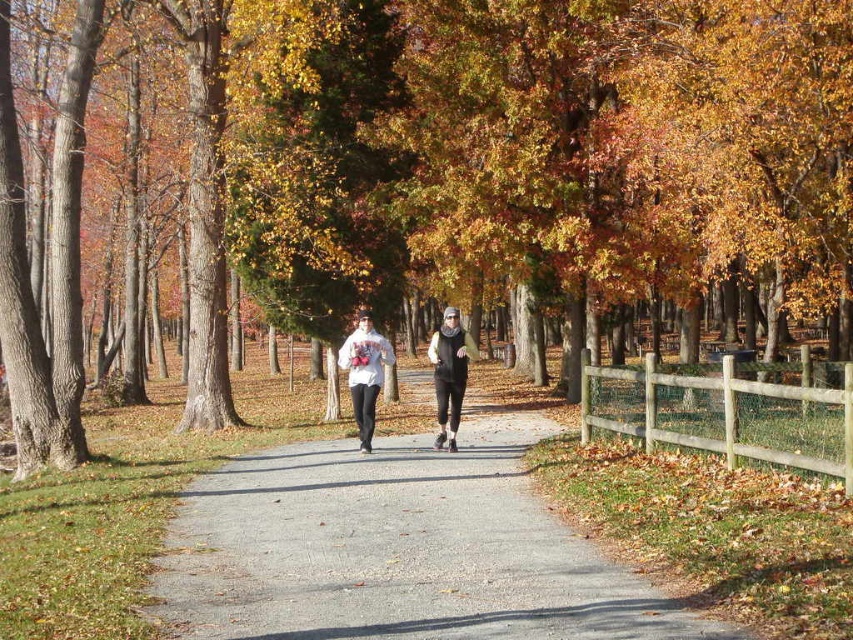
Question: Does brown wood fence at center have a lesser width compared to black matte jacket at center?

Choices:
 (A) yes
 (B) no

Answer: (B)

Question: Which object is farther from the camera taking this photo?

Choices:
 (A) white matte sweatshirt at center
 (B) white fleece hoodie at center

Answer: (A)

Question: Observing the image, what is the correct spatial positioning of brown wood fence at center in reference to white matte sweatshirt at center?

Choices:
 (A) right
 (B) left

Answer: (B)

Question: Among these objects, which one is farthest from the camera?

Choices:
 (A) gray asphalt path at center
 (B) white matte sweatshirt at center

Answer: (B)

Question: Among these objects, which one is farthest from the camera?

Choices:
 (A) black matte jacket at center
 (B) brown wood fence at center
 (C) white matte sweatshirt at center
 (D) white fleece hoodie at center

Answer: (C)

Question: Is brown wood fence at center bigger than white fleece hoodie at center?

Choices:
 (A) no
 (B) yes

Answer: (B)